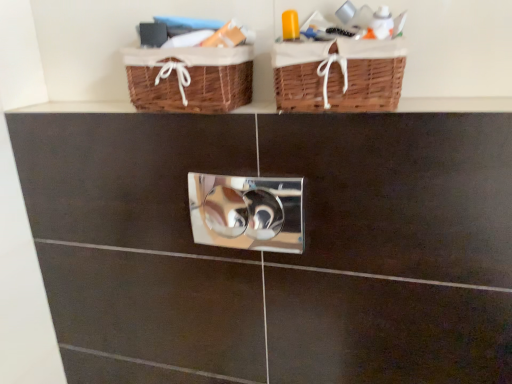
Image resolution: width=512 pixels, height=384 pixels. What do you see at coordinates (189, 79) in the screenshot?
I see `woven brown basket at upper center, which is counted as the first basket, starting from the left` at bounding box center [189, 79].

This screenshot has height=384, width=512. What do you see at coordinates (339, 75) in the screenshot?
I see `woven brown basket at upper center, the 2th basket viewed from the left` at bounding box center [339, 75].

What is the approximate height of polished silver lock at center?

7.07 inches.

What do you see at coordinates (247, 212) in the screenshot?
I see `polished silver lock at center` at bounding box center [247, 212].

Locate an element on the screen. The width and height of the screenshot is (512, 384). brown wicker baskets at upper center is located at coordinates (454, 104).

Does polished silver lock at center have a lesser width compared to woven brown basket at upper center, the 2th basket when ordered from right to left?

Correct, the width of polished silver lock at center is less than that of woven brown basket at upper center, the 2th basket when ordered from right to left.

What's the angular difference between polished silver lock at center and woven brown basket at upper center, which is counted as the first basket, starting from the left,'s facing directions?

The facing directions of polished silver lock at center and woven brown basket at upper center, which is counted as the first basket, starting from the left, are 0.0543 degrees apart.

Does polished silver lock at center touch woven brown basket at upper center, the 2th basket when ordered from right to left?

No, polished silver lock at center is not with woven brown basket at upper center, the 2th basket when ordered from right to left.

Is woven brown basket at upper center, which is counted as the first basket, starting from the left, at the back of polished silver lock at center?

No, polished silver lock at center is not facing the opposite direction of woven brown basket at upper center, which is counted as the first basket, starting from the left.

What are the coordinates of `lock behind the woven brown basket at upper center, the 2th basket when ordered from right to left` in the screenshot? It's located at (247, 212).

Considering the positions of objects woven brown basket at upper center, the 2th basket when ordered from right to left, and polished silver lock at center in the image provided, who is in front, woven brown basket at upper center, the 2th basket when ordered from right to left, or polished silver lock at center?

woven brown basket at upper center, the 2th basket when ordered from right to left, is more forward.

Is woven brown basket at upper center, which is counted as the first basket, starting from the left, next to polished silver lock at center?

No, woven brown basket at upper center, which is counted as the first basket, starting from the left, is not next to polished silver lock at center.

Is brown wicker baskets at upper center positioned with its back to woven brown basket at upper center, the 2th basket when ordered from right to left?

That's not correct — brown wicker baskets at upper center is not looking away from woven brown basket at upper center, the 2th basket when ordered from right to left.

Does brown wicker baskets at upper center have a smaller size compared to woven brown basket at upper center, which is counted as the first basket, starting from the left?

Yes, brown wicker baskets at upper center is smaller than woven brown basket at upper center, which is counted as the first basket, starting from the left.

From the picture: Does brown wicker baskets at upper center have a greater height compared to woven brown basket at upper center, which is counted as the first basket, starting from the left?

No, brown wicker baskets at upper center is not taller than woven brown basket at upper center, which is counted as the first basket, starting from the left.

Based on the photo, considering the positions of objects woven brown basket at upper center, the 2th basket when ordered from right to left, and brown wicker baskets at upper center in the image provided, who is behind, woven brown basket at upper center, the 2th basket when ordered from right to left, or brown wicker baskets at upper center?

woven brown basket at upper center, the 2th basket when ordered from right to left.

From the image's perspective, which is above, woven brown basket at upper center, which is counted as the first basket, starting from the left, or brown wicker baskets at upper center?

woven brown basket at upper center, which is counted as the first basket, starting from the left.

Would you say brown wicker baskets at upper center is part of woven brown basket at upper center, the 2th basket when ordered from right to left,'s contents?

No, brown wicker baskets at upper center is not inside woven brown basket at upper center, the 2th basket when ordered from right to left.

Is woven brown basket at upper center, which is counted as the first basket, starting from the left, turned away from brown wicker baskets at upper center?

That's not correct — woven brown basket at upper center, which is counted as the first basket, starting from the left, is not looking away from brown wicker baskets at upper center.

In the scene shown: Who is taller, brown wicker baskets at upper center or polished silver lock at center?

Standing taller between the two is polished silver lock at center.

Is brown wicker baskets at upper center oriented away from polished silver lock at center?

No, polished silver lock at center is not at the back of brown wicker baskets at upper center.

From a real-world perspective, between brown wicker baskets at upper center and polished silver lock at center, who is vertically higher?

brown wicker baskets at upper center, from a real-world perspective.

Is the depth of brown wicker baskets at upper center less than that of polished silver lock at center?

Yes, brown wicker baskets at upper center is in front of polished silver lock at center.

In the image, is woven brown basket at upper center, which appears as the first basket when viewed from the right, positioned in front of or behind woven brown basket at upper center, the 2th basket when ordered from right to left?

Visually, woven brown basket at upper center, which appears as the first basket when viewed from the right, is located in front of woven brown basket at upper center, the 2th basket when ordered from right to left.

This screenshot has width=512, height=384. What are the coordinates of `basket on the left of woven brown basket at upper center, which appears as the first basket when viewed from the right` in the screenshot? It's located at (189, 79).

Considering the sizes of objects woven brown basket at upper center, which appears as the first basket when viewed from the right, and woven brown basket at upper center, the 2th basket when ordered from right to left, in the image provided, who is bigger, woven brown basket at upper center, which appears as the first basket when viewed from the right, or woven brown basket at upper center, the 2th basket when ordered from right to left,?

With larger size is woven brown basket at upper center, which appears as the first basket when viewed from the right.

Is polished silver lock at center turned away from brown wicker baskets at upper center?

polished silver lock at center does not have its back to brown wicker baskets at upper center.

Considering the sizes of objects polished silver lock at center and brown wicker baskets at upper center in the image provided, who is smaller, polished silver lock at center or brown wicker baskets at upper center?

brown wicker baskets at upper center is smaller.

From the image's perspective, who appears lower, polished silver lock at center or brown wicker baskets at upper center?

polished silver lock at center appears lower in the image.

Who is shorter, polished silver lock at center or brown wicker baskets at upper center?

Standing shorter between the two is brown wicker baskets at upper center.

Find the location of a particular element. lock below the woven brown basket at upper center, the 2th basket when ordered from right to left (from a real-world perspective) is located at coordinates (247, 212).

From the image's perspective, starting from the polished silver lock at center, which basket is the 2nd one above? Please provide its 2D coordinates.

[(189, 79)]

Considering their positions, is polished silver lock at center positioned closer to brown wicker baskets at upper center than woven brown basket at upper center, which appears as the first basket when viewed from the right?

Among the two, polished silver lock at center is located nearer to brown wicker baskets at upper center.

When comparing their distances from brown wicker baskets at upper center, does woven brown basket at upper center, the 2th basket viewed from the left, or woven brown basket at upper center, the 2th basket when ordered from right to left, seem further?

The object further to brown wicker baskets at upper center is woven brown basket at upper center, the 2th basket viewed from the left.

From the picture: From the image, which object appears to be farther from woven brown basket at upper center, which is counted as the first basket, starting from the left, brown wicker baskets at upper center or polished silver lock at center?

The object further to woven brown basket at upper center, which is counted as the first basket, starting from the left, is polished silver lock at center.

Based on their spatial positions, is brown wicker baskets at upper center or woven brown basket at upper center, the 2th basket when ordered from right to left, closer to woven brown basket at upper center, the 2th basket viewed from the left?

Based on the image, woven brown basket at upper center, the 2th basket when ordered from right to left, appears to be nearer to woven brown basket at upper center, the 2th basket viewed from the left.

Estimate the real-world distances between objects in this image. Which object is further from polished silver lock at center, woven brown basket at upper center, the 2th basket when ordered from right to left, or brown wicker baskets at upper center?

Among the two, brown wicker baskets at upper center is located further to polished silver lock at center.

Estimate the real-world distances between objects in this image. Which object is closer to woven brown basket at upper center, which is counted as the first basket, starting from the left, polished silver lock at center or woven brown basket at upper center, which appears as the first basket when viewed from the right?

woven brown basket at upper center, which appears as the first basket when viewed from the right, lies closer to woven brown basket at upper center, which is counted as the first basket, starting from the left, than the other object.

Considering their positions, is woven brown basket at upper center, which is counted as the first basket, starting from the left, positioned further to polished silver lock at center than woven brown basket at upper center, the 2th basket viewed from the left?

woven brown basket at upper center, the 2th basket viewed from the left, is positioned further to the anchor polished silver lock at center.

From the image, which object appears to be farther from polished silver lock at center, brown wicker baskets at upper center or woven brown basket at upper center, which appears as the first basket when viewed from the right?

brown wicker baskets at upper center is positioned further to the anchor polished silver lock at center.

Image resolution: width=512 pixels, height=384 pixels. I want to click on ledge situated between woven brown basket at upper center, the 2th basket when ordered from right to left, and woven brown basket at upper center, which appears as the first basket when viewed from the right, from left to right, so click(454, 104).

Where is `ledge between woven brown basket at upper center, the 2th basket viewed from the left, and polished silver lock at center in the up-down direction`? The width and height of the screenshot is (512, 384). ledge between woven brown basket at upper center, the 2th basket viewed from the left, and polished silver lock at center in the up-down direction is located at coordinates (454, 104).

You are a GUI agent. You are given a task and a screenshot of the screen. Output one action in this format:
    pyautogui.click(x=<x>, y=<y>)
    Task: Click on the basket between woven brown basket at upper center, which is counted as the first basket, starting from the left, and polished silver lock at center, in the vertical direction
    This screenshot has height=384, width=512.
    Given the screenshot: What is the action you would take?
    pyautogui.click(x=339, y=75)

You are a GUI agent. You are given a task and a screenshot of the screen. Output one action in this format:
    pyautogui.click(x=<x>, y=<y>)
    Task: Click on the ledge between woven brown basket at upper center, which is counted as the first basket, starting from the left, and polished silver lock at center from top to bottom
    Image resolution: width=512 pixels, height=384 pixels.
    Given the screenshot: What is the action you would take?
    pyautogui.click(x=454, y=104)